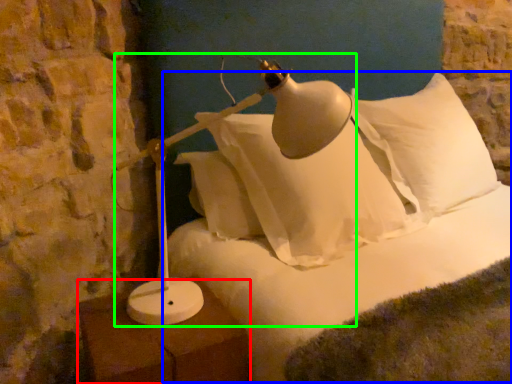
Question: Based on their relative distances, which object is nearer to furniture (highlighted by a red box)? Choose from bed (highlighted by a blue box) and lamp (highlighted by a green box).

Choices:
 (A) bed
 (B) lamp

Answer: (B)